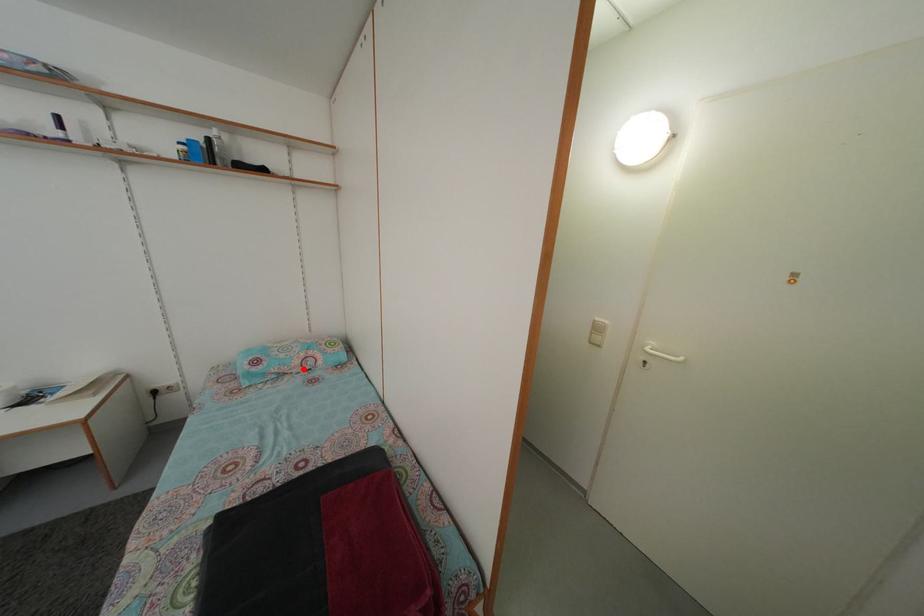
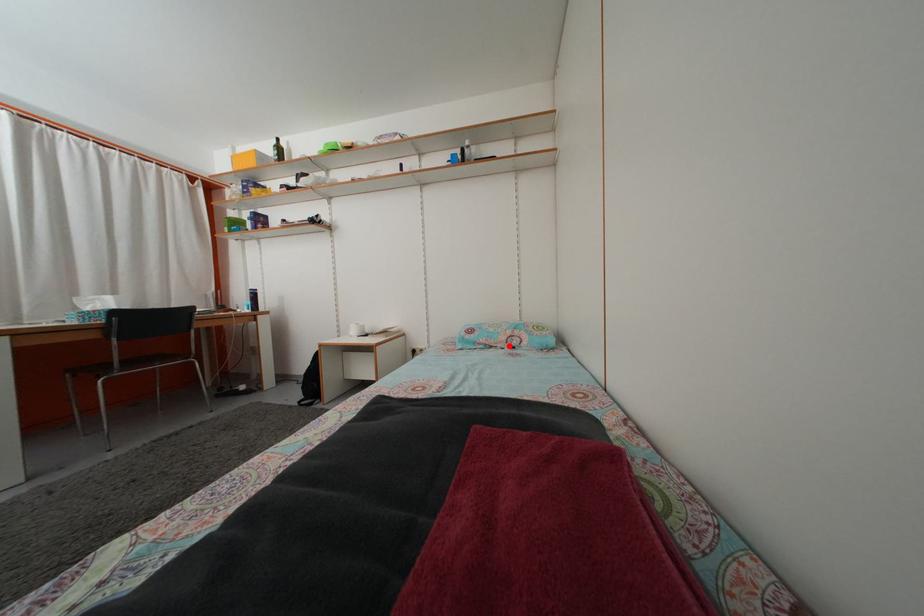
I am providing you with two images of the same scene from different viewpoints. A red point is marked on the first image and another point is marked on the second image. Is the marked point in image1 the same physical position as the marked point in image2?

Yes